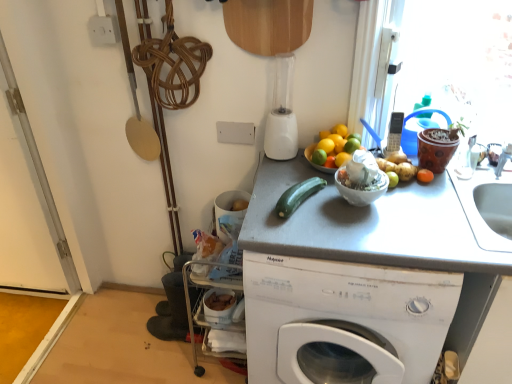
I want to click on free space that is to the left of yellow matte orange at center, the 1th orange in the bottom-to-top sequence, so click(296, 178).